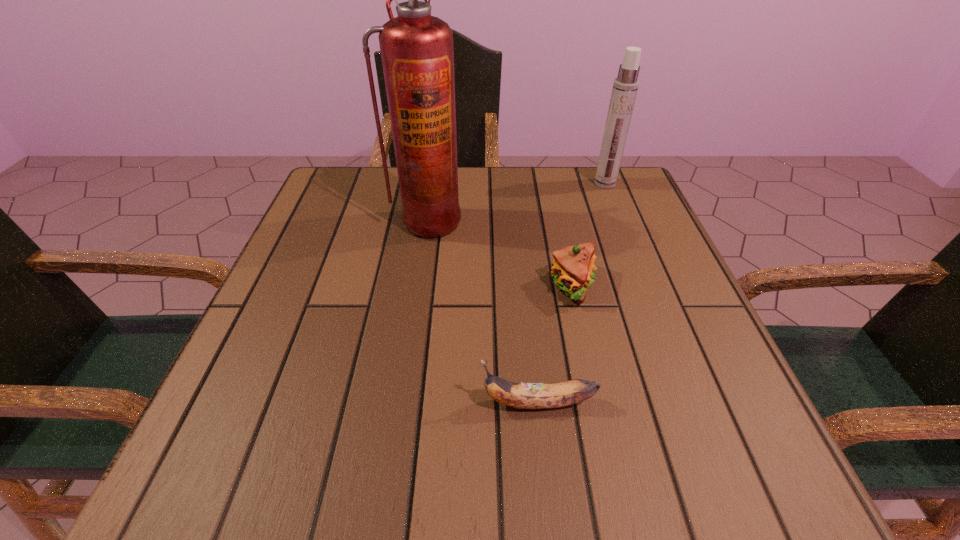
Where is `vacant space located 0.360m on the peel of the banana`? vacant space located 0.360m on the peel of the banana is located at coordinates (242, 403).

What are the coordinates of `blank space located 0.320m on the peel of the banana` in the screenshot? It's located at (269, 403).

Find the location of a particular element. The height and width of the screenshot is (540, 960). fire extinguisher present at the far edge is located at coordinates (417, 52).

What are the coordinates of `aerosol can at the far edge` in the screenshot? It's located at (625, 86).

Identify the location of object that is at the right edge. The height and width of the screenshot is (540, 960). (625, 86).

Image resolution: width=960 pixels, height=540 pixels. Find the location of `object that is at the far right corner`. object that is at the far right corner is located at coordinates (625, 86).

Locate an element on the screen. free space at the far edge of the desktop is located at coordinates (459, 195).

The height and width of the screenshot is (540, 960). I want to click on vacant region at the near edge of the desktop, so click(x=483, y=448).

Identify the location of free space at the left edge of the desktop. (345, 275).

Where is `vacant area at the right edge of the desktop`? vacant area at the right edge of the desktop is located at coordinates (616, 299).